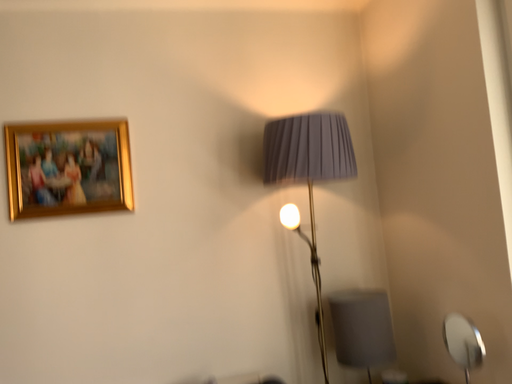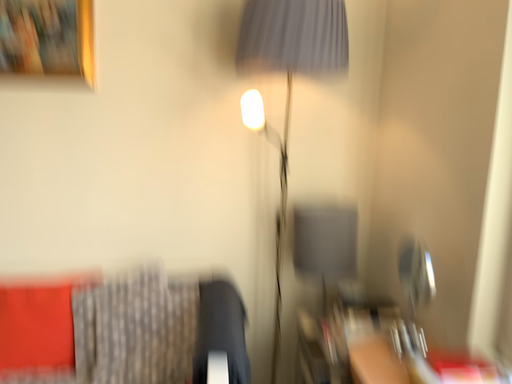
Question: How did the camera likely rotate when shooting the video?

Choices:
 (A) rotated right
 (B) rotated left

Answer: (B)